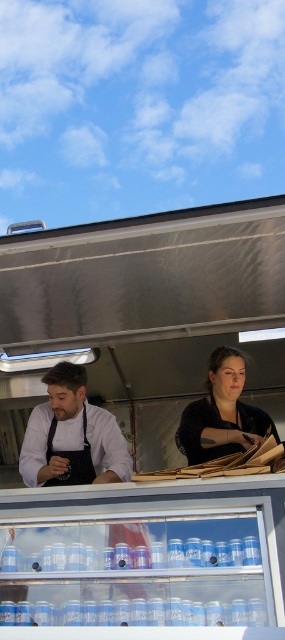
Which of these two, brushed metal food truck at center or matte black apron at left, stands taller?

brushed metal food truck at center is taller.

Which is behind, point (15, 480) or point (88, 412)?

The point (15, 480) is more distant.

Identify the location of brushed metal food truck at center. (137, 428).

Which is in front, point (228, 628) or point (237, 428)?

Point (228, 628) is in front.

Does brushed metal food truck at center have a lesser width compared to matte black jacket at center?

Incorrect, brushed metal food truck at center's width is not less than matte black jacket at center's.

Which is in front, point (51, 529) or point (253, 420)?

Point (51, 529) is in front.

You are a GUI agent. You are given a task and a screenshot of the screen. Output one action in this format:
    pyautogui.click(x=<x>, y=<y>)
    Task: Click on the brushed metal food truck at center
    Image resolution: width=285 pixels, height=640 pixels.
    Given the screenshot: What is the action you would take?
    pyautogui.click(x=137, y=428)

Based on the photo, who is higher up, matte black apron at left or matte black jacket at center?

matte black jacket at center is higher up.

Does matte black apron at left have a smaller size compared to matte black jacket at center?

Yes, matte black apron at left is smaller than matte black jacket at center.

Between point (90, 426) and point (226, 420), which one is positioned behind?

Point (90, 426)

The height and width of the screenshot is (640, 285). I want to click on matte black apron at left, so click(x=72, y=435).